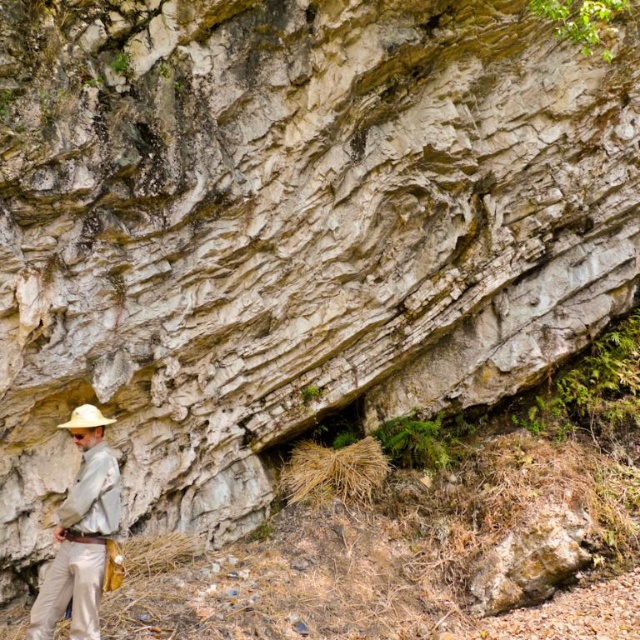
Question: Is khaki cotton pants at lower left further to the viewer compared to white matte cowboy hat at lower left?

Choices:
 (A) yes
 (B) no

Answer: (B)

Question: Can you confirm if khaki cotton pants at lower left is positioned below white matte cowboy hat at lower left?

Choices:
 (A) yes
 (B) no

Answer: (A)

Question: Which object appears farthest from the camera in this image?

Choices:
 (A) khaki cotton pants at lower left
 (B) white matte cowboy hat at lower left

Answer: (B)

Question: Is khaki cotton pants at lower left thinner than white matte cowboy hat at lower left?

Choices:
 (A) no
 (B) yes

Answer: (A)

Question: Which object appears closest to the camera in this image?

Choices:
 (A) white matte cowboy hat at lower left
 (B) khaki cotton pants at lower left

Answer: (B)

Question: Which of the following is the closest to the observer?

Choices:
 (A) (67, 573)
 (B) (81, 412)

Answer: (A)